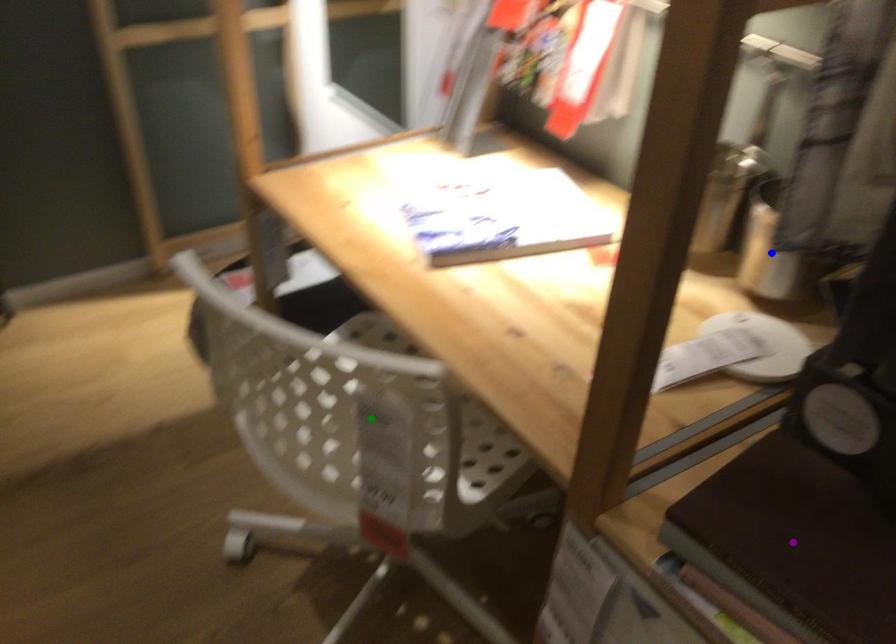
Order these from nearest to farthest:
blue point | green point | purple point

purple point → blue point → green point